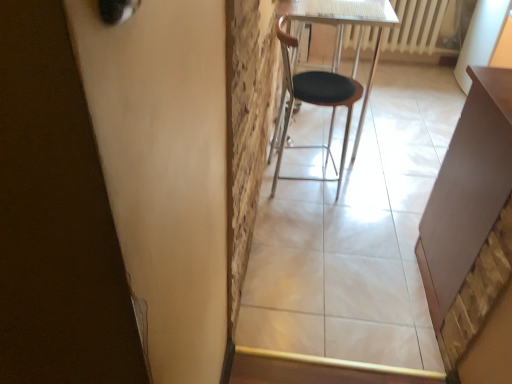
Question: Considering the positions of black leather chair at center and matte brown table at right in the image, is black leather chair at center wider or thinner than matte brown table at right?

Choices:
 (A) thin
 (B) wide

Answer: (A)

Question: Is black leather chair at center bigger or smaller than matte brown table at right?

Choices:
 (A) small
 (B) big

Answer: (A)

Question: Which is farther from the matte brown table at right?

Choices:
 (A) black leather chair at center
 (B) white plastic radiator at upper right

Answer: (B)

Question: Which of these objects is positioned closest to the white plastic radiator at upper right?

Choices:
 (A) black leather chair at center
 (B) matte brown table at right

Answer: (A)